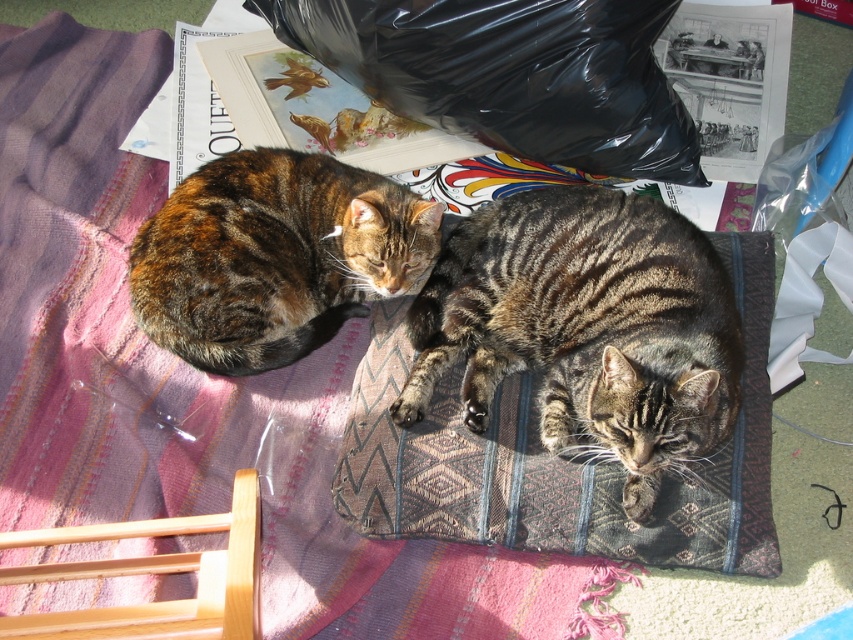
Question: Which object is closer to the camera taking this photo?

Choices:
 (A) tabby fur cat at center
 (B) pink woven blanket at upper left

Answer: (A)

Question: Is pink woven blanket at upper left bigger than tabby fur cat at left?

Choices:
 (A) yes
 (B) no

Answer: (A)

Question: From the image, what is the correct spatial relationship of pink woven blanket at upper left in relation to tabby fur cat at center?

Choices:
 (A) left
 (B) right

Answer: (A)

Question: Which point appears farthest from the camera in this image?

Choices:
 (A) (103, 512)
 (B) (512, 97)
 (C) (234, 352)
 (D) (473, 272)

Answer: (B)

Question: Which object is the farthest from the tabby fur cat at center?

Choices:
 (A) pink woven blanket at upper left
 (B) tabby fur cat at left

Answer: (A)

Question: Does pink woven blanket at upper left have a lesser width compared to black plastic bag at upper center?

Choices:
 (A) yes
 (B) no

Answer: (B)